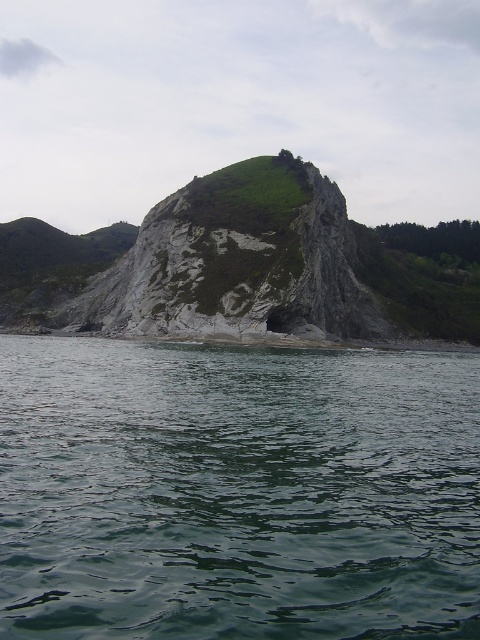
Question: Which point is closer to the camera taking this photo?

Choices:
 (A) (235, 236)
 (B) (22, 364)

Answer: (B)

Question: Which point is farther to the camera?

Choices:
 (A) rough gray rock at center
 (B) green liquid water at center

Answer: (A)

Question: Does green liquid water at center appear under rough gray rock at center?

Choices:
 (A) yes
 (B) no

Answer: (A)

Question: Considering the relative positions of green liquid water at center and rough gray rock at center in the image provided, where is green liquid water at center located with respect to rough gray rock at center?

Choices:
 (A) right
 (B) left

Answer: (B)

Question: Can you confirm if green liquid water at center is bigger than rough gray rock at center?

Choices:
 (A) no
 (B) yes

Answer: (A)

Question: Which object appears closest to the camera in this image?

Choices:
 (A) green liquid water at center
 (B) rough gray rock at center

Answer: (A)